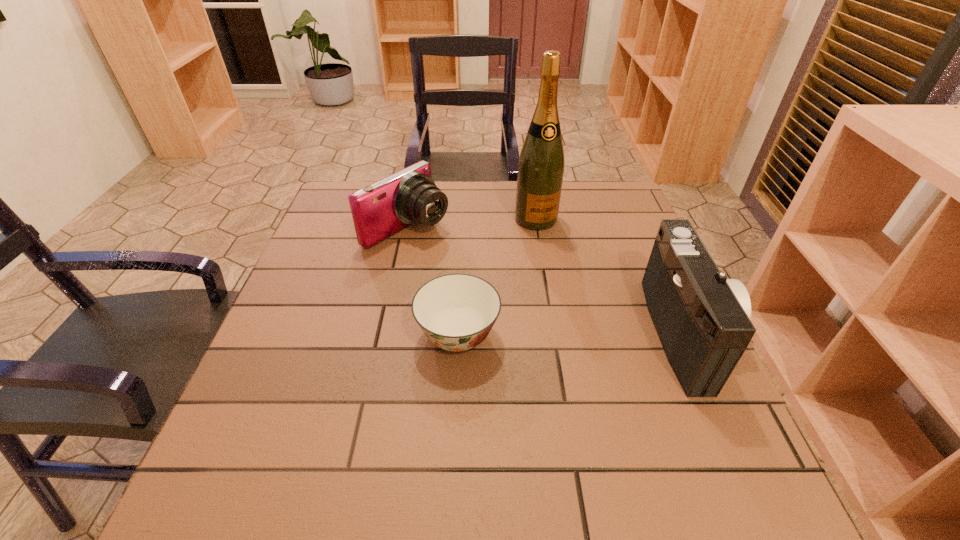
What are the coordinates of `free spot that satisfies the following two spatial constraints: 1. on the front side of the third tallest object; 2. on the lens of the rightmost object` in the screenshot? It's located at click(x=386, y=333).

At what (x,y) coordinates should I click in order to perform the action: click on free space that satisfies the following two spatial constraints: 1. on the front side of the camcorder; 2. on the lens of the third tallest object. Please return your answer as a coordinate pair (x, y). Looking at the image, I should click on (386, 333).

You are a GUI agent. You are given a task and a screenshot of the screen. Output one action in this format:
    pyautogui.click(x=<x>, y=<y>)
    Task: Click on the free location that satisfies the following two spatial constraints: 1. on the back side of the camera; 2. on the right side of the tallest object
    The image size is (960, 540).
    Given the screenshot: What is the action you would take?
    pyautogui.click(x=409, y=219)